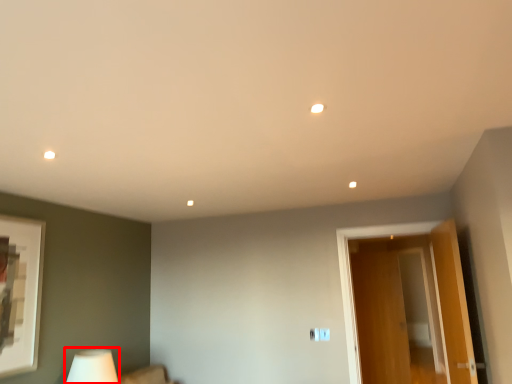
Question: From the image's perspective, what is the correct spatial relationship of table lamp (annotated by the red box) in relation to door?

Choices:
 (A) above
 (B) below

Answer: (B)